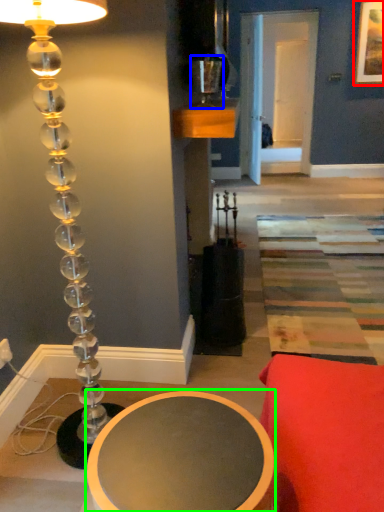
Question: Estimate the real-world distances between objects in this image. Which object is closer to picture frame (highlighted by a red box), candle holder (highlighted by a blue box) or table (highlighted by a green box)?

Choices:
 (A) candle holder
 (B) table

Answer: (A)